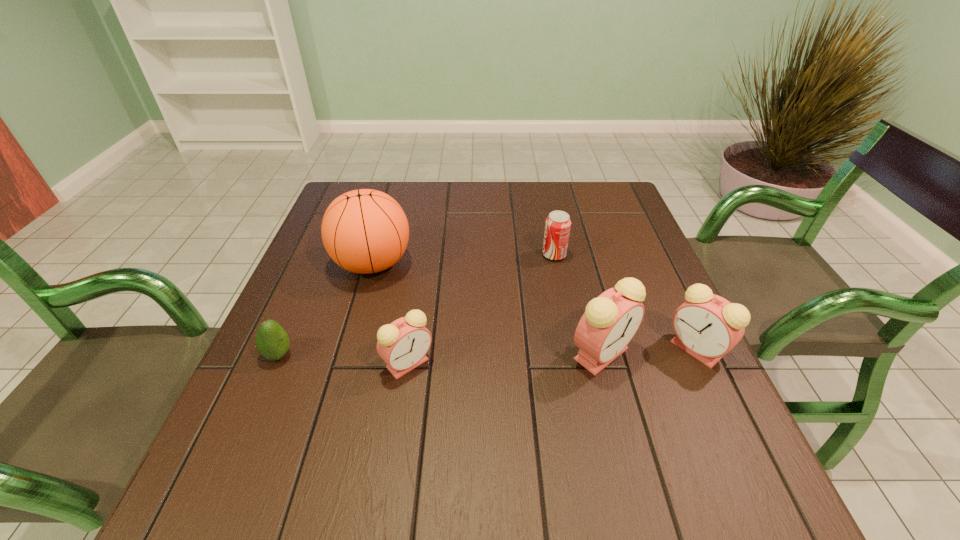
In the image, there is a desktop. In order to click on vacant space at the far edge in this screenshot , I will do `click(471, 188)`.

In the image, there is a desktop. Where is `vacant space at the near edge`? The height and width of the screenshot is (540, 960). vacant space at the near edge is located at coordinates (559, 427).

The width and height of the screenshot is (960, 540). I want to click on vacant space at the right edge, so click(x=594, y=229).

The height and width of the screenshot is (540, 960). In the image, there is a desktop. What are the coordinates of `free space at the near left corner` in the screenshot? It's located at (268, 417).

In the image, there is a desktop. Identify the location of free space at the far right corner. Image resolution: width=960 pixels, height=540 pixels. (608, 198).

I want to click on free space at the near right corner, so click(x=708, y=432).

This screenshot has height=540, width=960. What are the coordinates of `vacant space in between the avocado and the soda can` in the screenshot? It's located at (416, 305).

I want to click on empty location between the leftmost alarm clock and the soda can, so click(x=481, y=309).

You are a GUI agent. You are given a task and a screenshot of the screen. Output one action in this format:
    pyautogui.click(x=<x>, y=<y>)
    Task: Click on the vacant space that is in between the fourth shortest object and the avocado
    The height and width of the screenshot is (540, 960).
    Given the screenshot: What is the action you would take?
    pyautogui.click(x=487, y=352)

What are the coordinates of `vacant region between the basketball and the avocado` in the screenshot? It's located at (325, 309).